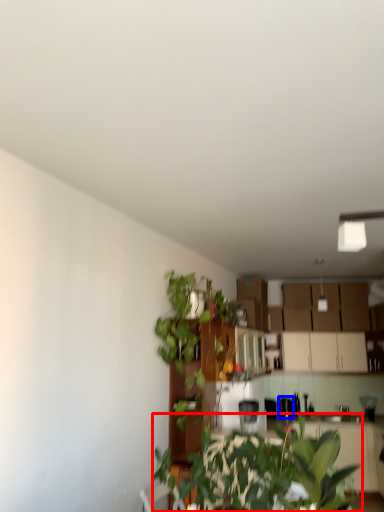
Question: Which of the following is the farthest to the observer, houseplant (highlighted by a red box) or appliance (highlighted by a blue box)?

Choices:
 (A) houseplant
 (B) appliance

Answer: (B)